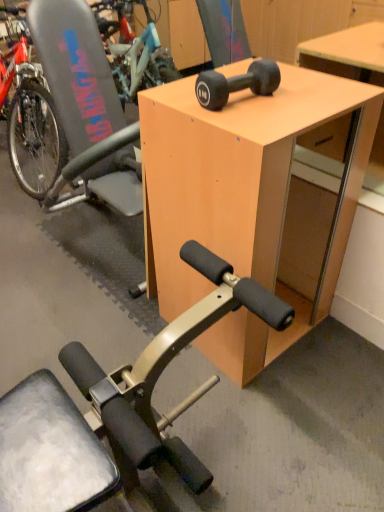
In order to click on free point to the left of black rubber dumbbell at upper center in this screenshot , I will do `click(175, 98)`.